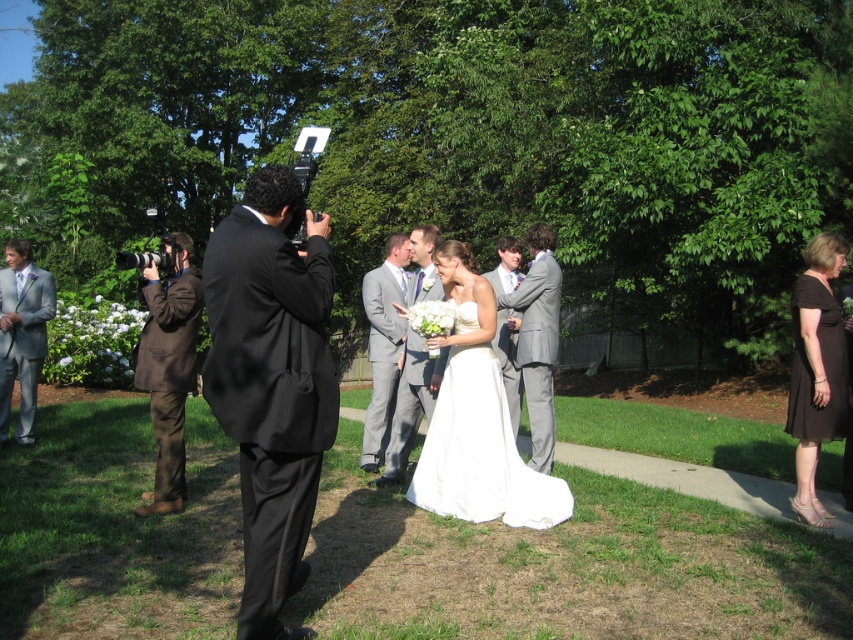
You are a guest at the wedding and want to take a photo with the gray suit at center and the light gray suit at left. Which one is positioned lower in the image?

The gray suit at center is positioned lower in the image than the light gray suit at left.

In the wedding scene, there is a brown wool suit at left and a gray satin suit at center. Which one is positioned more to the left side of the image?

The brown wool suit at left is positioned more to the left side of the image than the gray satin suit at center.

You are a photographer standing next to the man in the black suit with a camera on a tripod. You need to capture a photo that includes both the white satin dress at center and the black satin dress at lower right. Based on their positions, do you think they are close enough to fit in the same frame?

The white satin dress at center and the black satin dress at lower right are 2.30 meters apart from each other. Whether they can fit in the same frame depends on the camera lens used. A standard lens might require adjusting the framing, but a wide angle lens could likely capture both subjects comfortably.